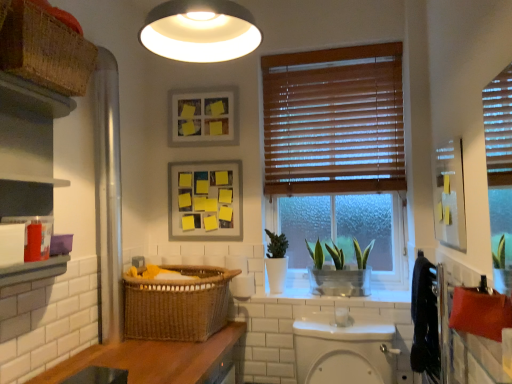
Question: Is white matte light fixture at upper center in front of woven brown basket at lower left, the 2th basket from the left?

Choices:
 (A) yes
 (B) no

Answer: (A)

Question: Considering the relative positions of white matte light fixture at upper center and woven brown basket at lower left, the 2th basket from the left, in the image provided, is white matte light fixture at upper center to the right of woven brown basket at lower left, the 2th basket from the left, from the viewer's perspective?

Choices:
 (A) yes
 (B) no

Answer: (A)

Question: Is white matte light fixture at upper center placed right next to woven brown basket at lower left, marked as the second basket in a top-to-bottom arrangement?

Choices:
 (A) yes
 (B) no

Answer: (B)

Question: Is white matte light fixture at upper center looking in the opposite direction of woven brown basket at lower left, marked as the second basket in a top-to-bottom arrangement?

Choices:
 (A) no
 (B) yes

Answer: (A)

Question: Is white matte light fixture at upper center taller than woven brown basket at lower left, marked as the second basket in a top-to-bottom arrangement?

Choices:
 (A) yes
 (B) no

Answer: (B)

Question: From their relative heights in the image, would you say yellow sticky notes on matte paper at upper center, which ranks as the 1th picture frame in bottom-to-top order, is taller or shorter than matte black cabinet at left?

Choices:
 (A) short
 (B) tall

Answer: (A)

Question: In the image, is yellow sticky notes on matte paper at upper center, which ranks as the 1th picture frame in bottom-to-top order, positioned in front of or behind matte black cabinet at left?

Choices:
 (A) behind
 (B) front

Answer: (A)

Question: Looking at the image, does yellow sticky notes on matte paper at upper center, arranged as the 2th picture frame when viewed from the top, seem bigger or smaller compared to matte black cabinet at left?

Choices:
 (A) big
 (B) small

Answer: (B)

Question: Is point (175, 206) positioned closer to the camera than point (25, 160)?

Choices:
 (A) closer
 (B) farther

Answer: (B)

Question: Is point pyautogui.click(x=42, y=196) positioned closer to the camera than point pyautogui.click(x=396, y=104)?

Choices:
 (A) farther
 (B) closer

Answer: (B)

Question: Is matte black cabinet at left situated inside wooden blinds at center or outside?

Choices:
 (A) inside
 (B) outside

Answer: (B)

Question: From the image's perspective, is matte black cabinet at left above or below wooden blinds at center?

Choices:
 (A) above
 (B) below

Answer: (B)

Question: Based on their positions, is matte black cabinet at left located to the left or right of wooden blinds at center?

Choices:
 (A) left
 (B) right

Answer: (A)

Question: Considering the positions of point (75, 36) and point (330, 314), is point (75, 36) closer or farther from the camera than point (330, 314)?

Choices:
 (A) closer
 (B) farther

Answer: (A)

Question: From the image's perspective, relative to white glossy toilet bowl at center, is woven brown basket at upper left, which is the second basket in bottom-to-top order, above or below?

Choices:
 (A) below
 (B) above

Answer: (B)